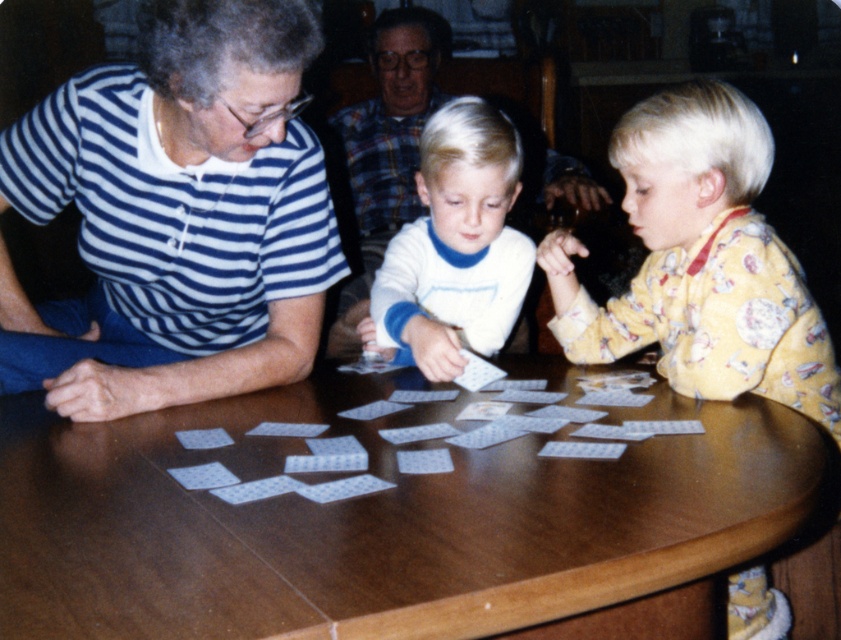
Question: Which point is closer to the camera taking this photo?

Choices:
 (A) (406, 348)
 (B) (110, 86)
 (C) (267, 493)
 (D) (765, 394)

Answer: (C)

Question: Can you confirm if blue striped shirt at left is wider than white soft cotton shirt at center?

Choices:
 (A) yes
 (B) no

Answer: (A)

Question: Estimate the real-world distances between objects in this image. Which object is farther from the translucent plastic cards at center?

Choices:
 (A) white soft cotton shirt at center
 (B) blue striped shirt at left
 (C) wooden table at center

Answer: (B)

Question: Which is farther from the yellow cotton pajamas at right?

Choices:
 (A) blue striped shirt at left
 (B) translucent plastic cards at center

Answer: (A)

Question: Is blue striped shirt at left to the right of white soft cotton shirt at center from the viewer's perspective?

Choices:
 (A) yes
 (B) no

Answer: (B)

Question: Observing the image, what is the correct spatial positioning of yellow cotton pajamas at right in reference to white soft cotton shirt at center?

Choices:
 (A) below
 (B) above

Answer: (A)